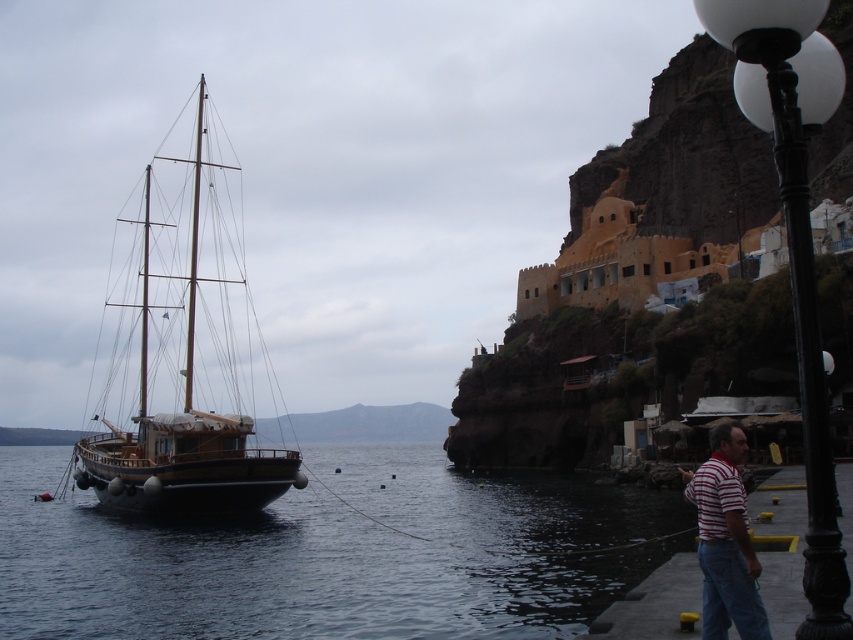
Question: Which object is the farthest from the black metal lamp post at lower right?

Choices:
 (A) dark blue water at left
 (B) striped cotton shirt at lower right

Answer: (A)

Question: Does black metal lamp post at lower right have a greater width compared to striped cotton shirt at lower right?

Choices:
 (A) yes
 (B) no

Answer: (B)

Question: Which point appears closest to the camera in this image?

Choices:
 (A) (264, 632)
 (B) (831, 548)
 (C) (761, 628)
 (D) (184, 397)

Answer: (B)

Question: Is dark blue water at left positioned at the back of striped cotton shirt at lower right?

Choices:
 (A) no
 (B) yes

Answer: (B)

Question: Considering the relative positions of dark blue water at left and black metal lamp post at lower right in the image provided, where is dark blue water at left located with respect to black metal lamp post at lower right?

Choices:
 (A) left
 (B) right

Answer: (A)

Question: Which of the following is the closest to the observer?

Choices:
 (A) dark blue water at left
 (B) black metal lamp post at lower right
 (C) striped cotton shirt at lower right

Answer: (B)